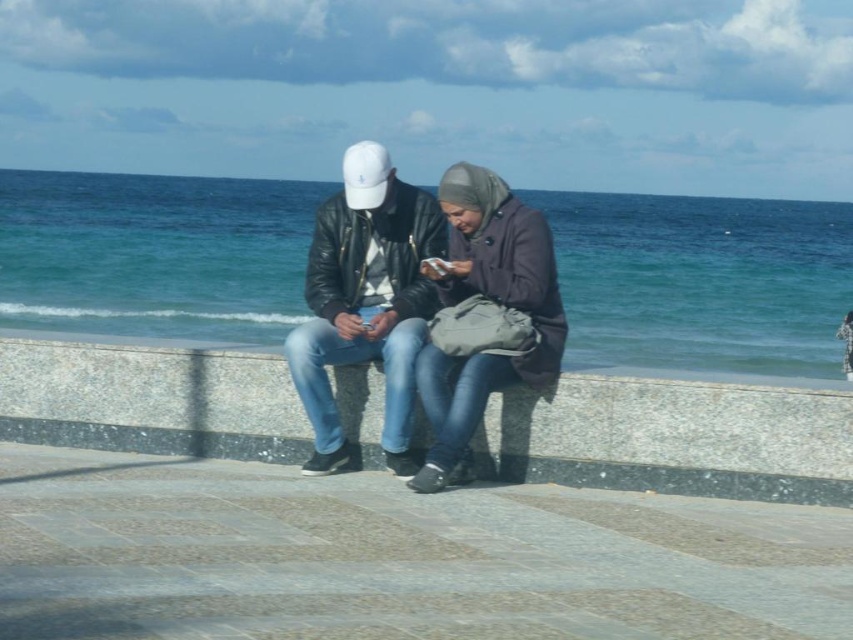
Does leather jacket at center have a lesser width compared to matte purple coat at center?

In fact, leather jacket at center might be wider than matte purple coat at center.

Is point (345, 296) more distant than point (479, 268)?

Yes, point (345, 296) is farther from viewer.

Does point (320, 378) lie behind point (473, 200)?

Yes, it is behind point (473, 200).

This screenshot has width=853, height=640. Find the location of `leather jacket at center`. leather jacket at center is located at coordinates (366, 301).

Which is below, gray concrete ledge at center or matte purple coat at center?

Positioned lower is gray concrete ledge at center.

Is point (120, 348) positioned before point (425, 358)?

No, (120, 348) is behind (425, 358).

Locate an element on the screen. Image resolution: width=853 pixels, height=640 pixels. gray concrete ledge at center is located at coordinates (x=675, y=435).

Does point (252, 445) come farther from viewer compared to point (334, 212)?

Yes.

Is point (39, 340) closer to viewer compared to point (338, 356)?

No, it is not.

Locate an element on the screen. The image size is (853, 640). gray concrete ledge at center is located at coordinates (675, 435).